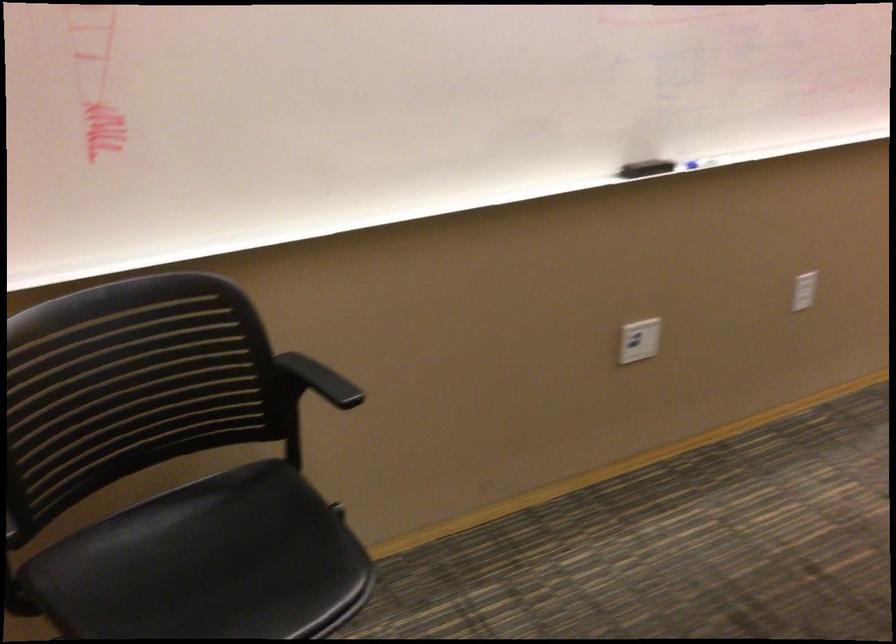
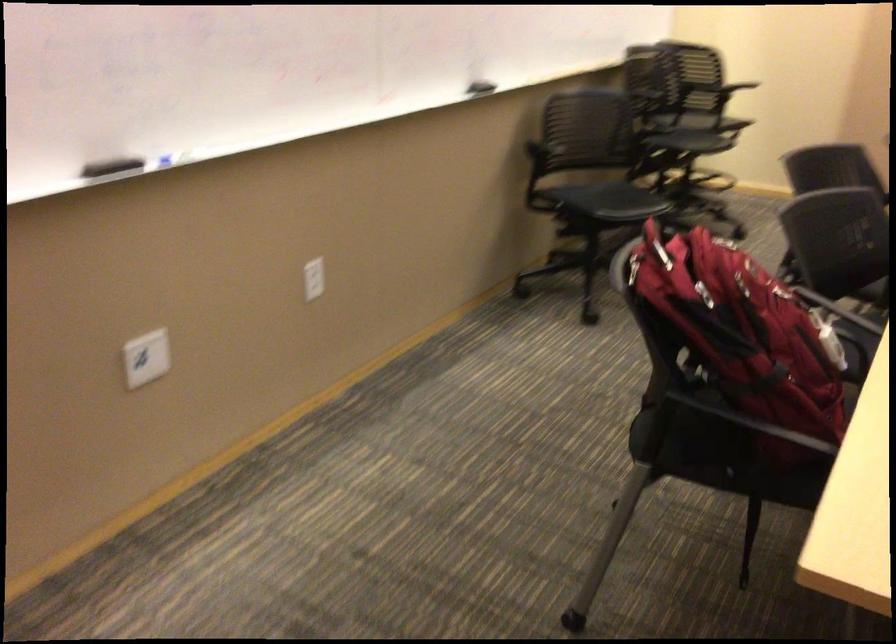
Question: The first image is from the beginning of the video and the second image is from the end. How did the camera likely rotate when shooting the video?

Choices:
 (A) Left
 (B) Right
 (C) Up
 (D) Down

Answer: (B)